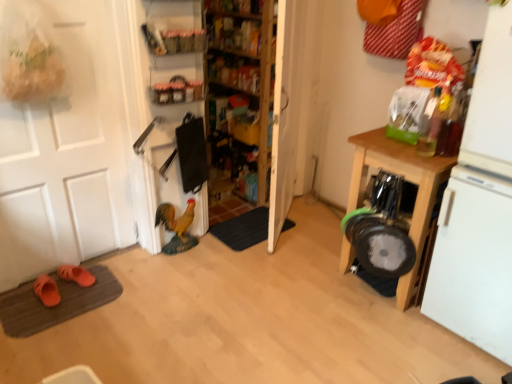
Find the location of a particular element. Image resolution: width=512 pixels, height=384 pixels. vacant area on top of orange rubber slippers at lower left, positioned as the first footwear in front-to-back order (from a real-world perspective) is located at coordinates (47, 284).